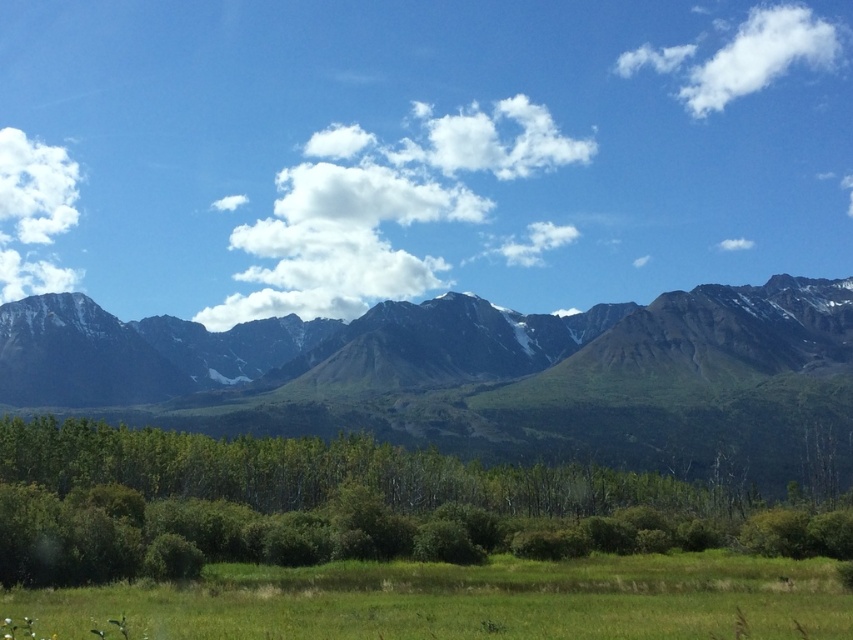
Question: Considering the real-world distances, which object is closest to the white fluffy cloud at center?

Choices:
 (A) green leafy trees at lower center
 (B) green grassy field at lower center
 (C) green grassy mountain range at center
 (D) white fluffy cloud at upper left

Answer: (C)

Question: Which of the following is the closest to the observer?

Choices:
 (A) green grassy mountain range at center
 (B) green grassy field at lower center
 (C) green leafy trees at lower center
 (D) white fluffy cloud at upper left

Answer: (B)

Question: Which object appears closest to the camera in this image?

Choices:
 (A) green grassy field at lower center
 (B) green grassy mountain range at center

Answer: (A)

Question: Is green grassy field at lower center wider than white fluffy cloud at upper right?

Choices:
 (A) yes
 (B) no

Answer: (B)

Question: Is white fluffy cloud at upper right wider than white fluffy cloud at upper left?

Choices:
 (A) yes
 (B) no

Answer: (A)

Question: Is green grassy field at lower center in front of white fluffy cloud at upper left?

Choices:
 (A) yes
 (B) no

Answer: (A)